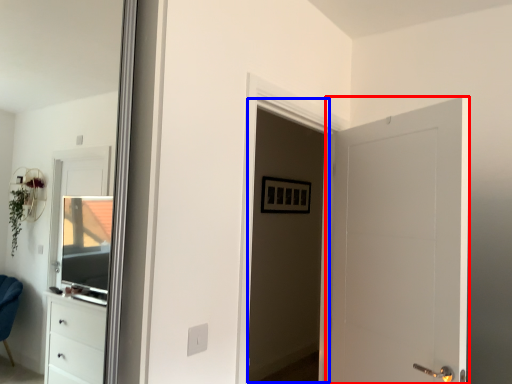
Question: Which object appears closest to the camera in this image, door (highlighted by a red box) or screen door (highlighted by a blue box)?

Choices:
 (A) door
 (B) screen door

Answer: (A)